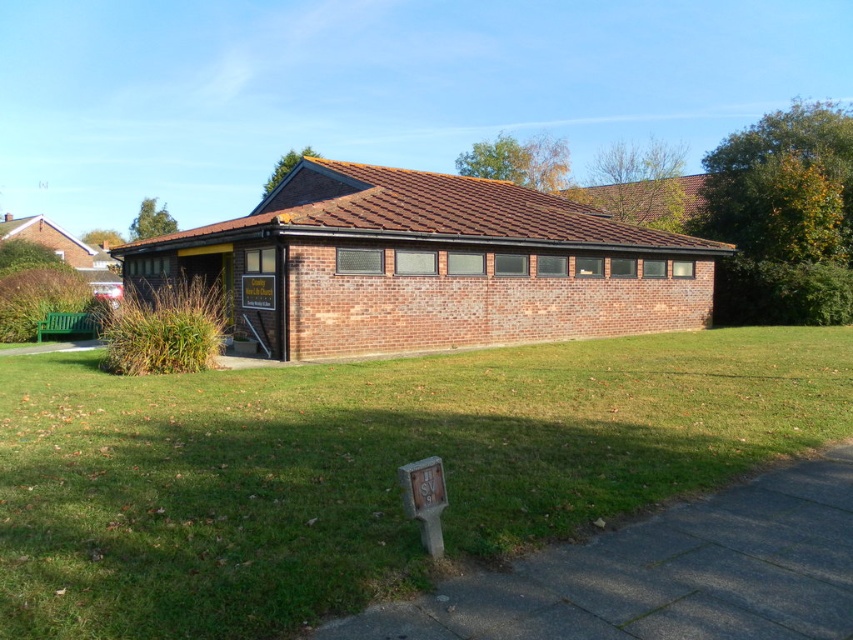
You are a delivery person who needs to park your 15 feet long delivery truck in the area between the green grass at center and the brick building at center. Is there enough space for the truck to park there?

The distance between the green grass at center and the brick building at center is 26.76 feet. Since the truck is 15 feet long, there is sufficient space to park as 26.76 feet is greater than 15 feet.